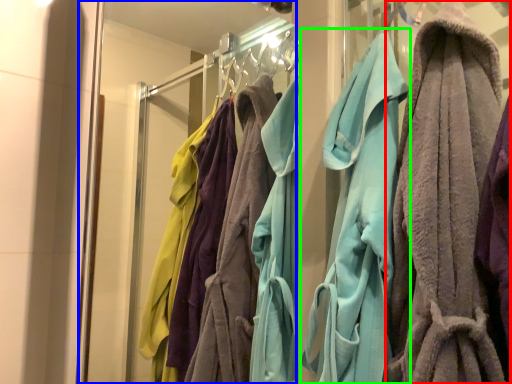
Question: Considering the real-world distances, which object is closest to towel (highlighted by a red box)? glass door (highlighted by a blue box) or towel (highlighted by a green box).

Choices:
 (A) glass door
 (B) towel

Answer: (B)